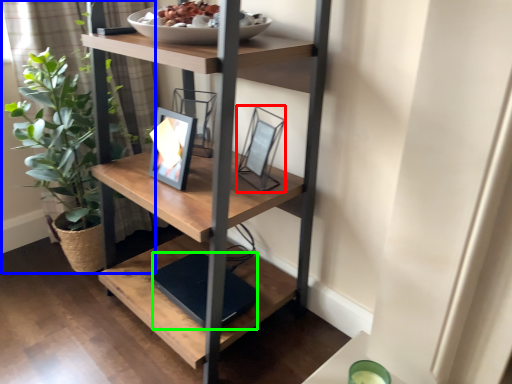
Question: Which is farther away from picture frame (highlighted by a red box)? houseplant (highlighted by a blue box) or lift (highlighted by a green box)?

Choices:
 (A) houseplant
 (B) lift

Answer: (A)